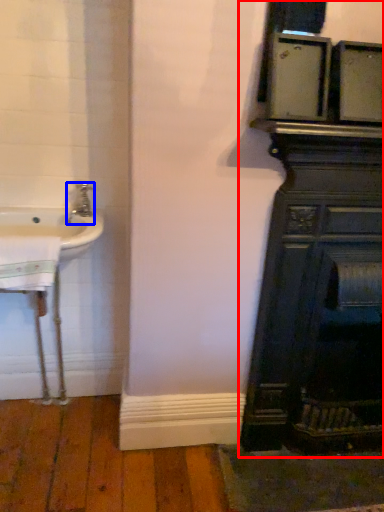
Question: Which object appears closest to the camera in this image, bathroom cabinet (highlighted by a red box) or tap (highlighted by a blue box)?

Choices:
 (A) bathroom cabinet
 (B) tap

Answer: (A)